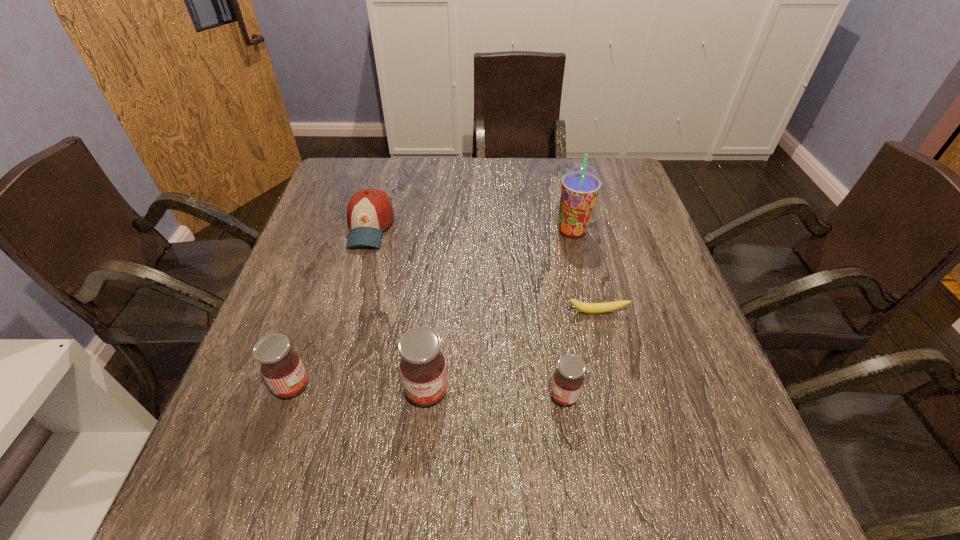
The jams are evenly distributed in the image. To maintain this, where would you place another jam on the right? Please point to a free space. Please provide its 2D coordinates. Your answer should be formatted as a tuple, i.e. [(x, y)], where the tuple contains the x and y coordinates of a point satisfying the conditions above.

[(704, 401)]